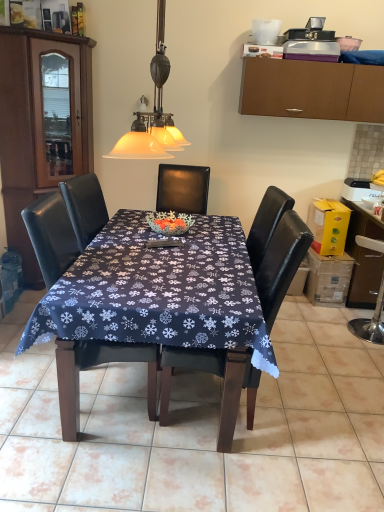
Question: Would you say dark blue fabric at center is inside or outside black leather chair at center, the 2th chair in the right-to-left sequence?

Choices:
 (A) inside
 (B) outside

Answer: (B)

Question: Considering the positions of point (301, 403) and point (26, 216), is point (301, 403) closer or farther from the camera than point (26, 216)?

Choices:
 (A) closer
 (B) farther

Answer: (B)

Question: Which object is the farthest from the brown wood cabinet at left, which ranks as the first cabinetry in left-to-right order?

Choices:
 (A) black leather chair at center, acting as the second chair starting from the left
 (B) dark blue fabric at center
 (C) translucent glass pendant light at upper center
 (D) black leather chair at center, arranged as the 1th chair when viewed from the left
 (E) brown matte cabinet at upper right, which is the 1th cabinetry from right to left

Answer: (A)

Question: Based on their relative distances, which object is farther from the metallic silver swivel chair at right?

Choices:
 (A) brown wood cabinet at left, which ranks as the first cabinetry in left-to-right order
 (B) brown matte cabinet at upper right, which is the 1th cabinetry from right to left
 (C) black leather chair at center, which is the 1th chair from right to left
 (D) dark blue fabric at center
 (E) dark blue fabric tablecloth at center

Answer: (A)